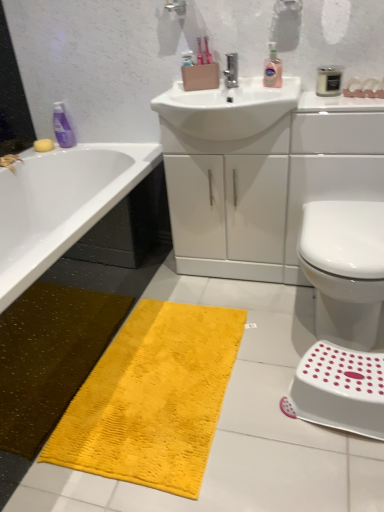
In order to click on empty space that is in between white glossy bidet at lower right and white glossy sink at center in this screenshot , I will do `click(254, 306)`.